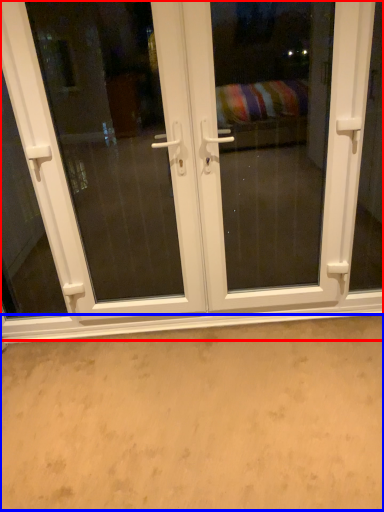
Question: Which point is further to the camera, door (highlighted by a red box) or plain (highlighted by a blue box)?

Choices:
 (A) door
 (B) plain

Answer: (A)